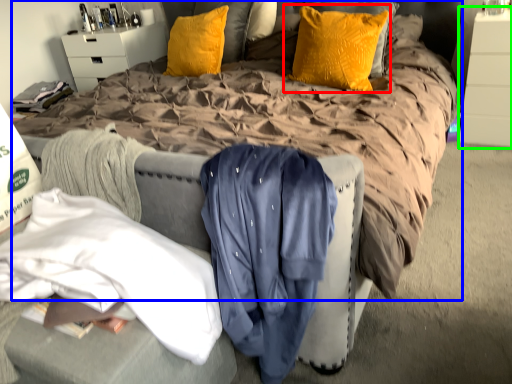
Question: Which object is positioned farthest from pillow (highlighted by a red box)? Select from bed (highlighted by a blue box) and dresser (highlighted by a green box).

Choices:
 (A) bed
 (B) dresser

Answer: (B)